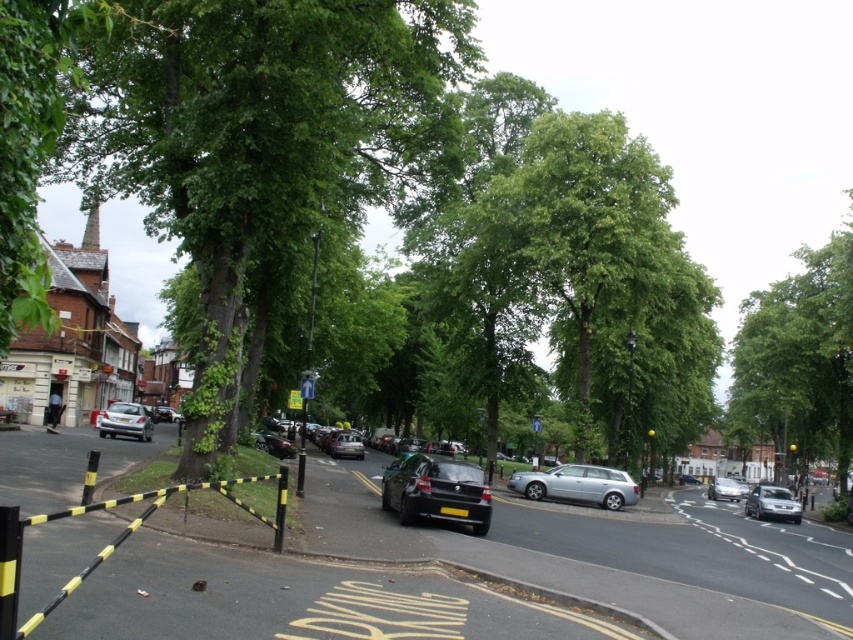
Question: Which point is farther from the camera taking this photo?

Choices:
 (A) (787, 496)
 (B) (686, 474)
 (C) (728, 497)

Answer: (B)

Question: From the image, what is the correct spatial relationship of shiny black sedan at center in relation to silver metallic station wagon at center?

Choices:
 (A) below
 (B) above

Answer: (B)

Question: Which point is closer to the camera?

Choices:
 (A) (349, 449)
 (B) (154, 413)
 (C) (270, 451)

Answer: (C)

Question: Is silver metallic station wagon at center to the right of shiny silver sedan at left from the viewer's perspective?

Choices:
 (A) yes
 (B) no

Answer: (A)

Question: Can you confirm if silver metallic hatchback at center-right is positioned to the right of silver metallic hatchback at center?

Choices:
 (A) no
 (B) yes

Answer: (A)

Question: Which of the following is the farthest from the observer?

Choices:
 (A) (274, 452)
 (B) (801, 292)

Answer: (B)